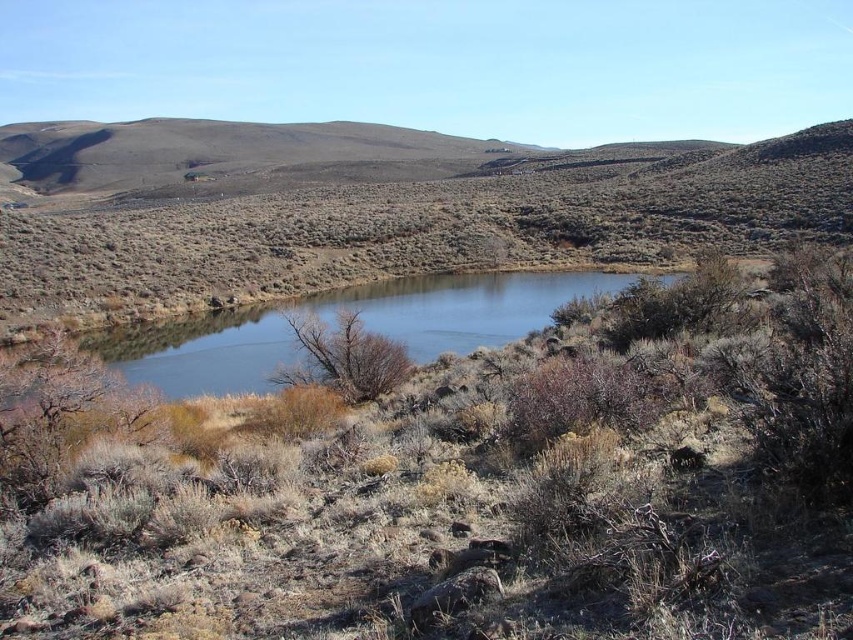
You are a hiker standing at the bottom of the hill. You want to reach the top of the brown textured hillside at upper center. According to the map, the coordinates of the hillside are at point 0.356, 0.498. Is the hillside located to your north or south?

The brown textured hillside at upper center is located at coordinates (424, 227). Since the y coordinate is 0.498, which is closer to 0.5, it is positioned near the upper part of the image, so it is to your north.

You are standing at the edge of the lake and want to walk to the dry grass at center. Which direction should you head towards?

The dry grass at center is located at point (465, 486), so you should head towards the center of the image to reach it.

You are standing at the edge of the clear water at center and want to climb up to the brown textured hillside at upper center. Based on the scene, do you think the hillside is higher or lower than the water level?

The brown textured hillside at upper center is much taller than the clear water at center, so the hillside is higher than the water level.